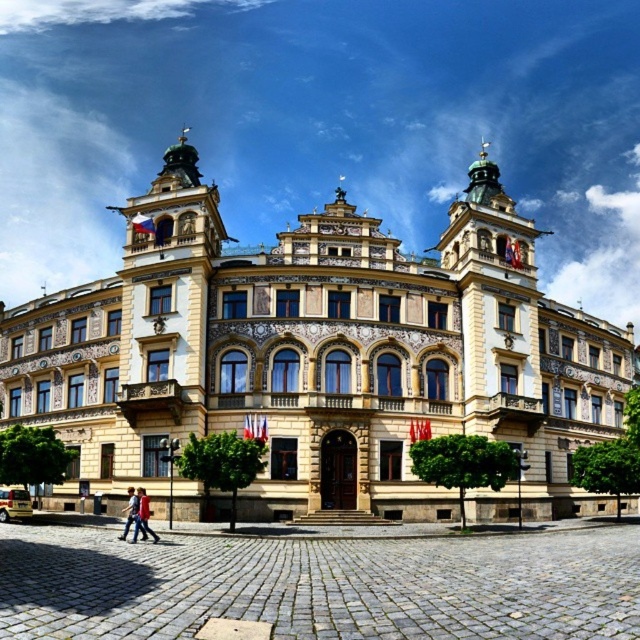
You are standing in front of the yellow stone building at center and looking towards the red shirt at lower left. Which object is closer to you?

The yellow stone building at center is closer to you because it is positioned over the red shirt at lower left, indicating it is in front.

You are standing at the coordinates 0.5, 0.5 in the image. You want to walk directly towards the yellow stone building at center. In which direction should you move?

Since the yellow stone building at center is located at coordinates [316,353], and you are at [320,320], you should move slightly to the northeast to reach it.